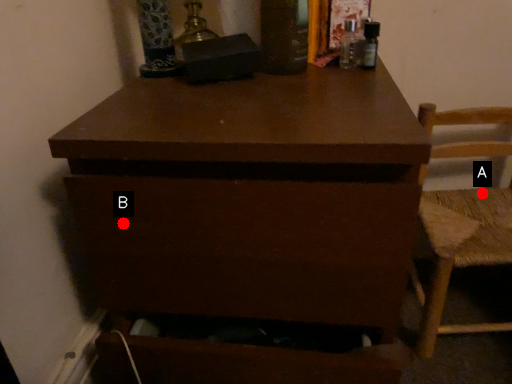
Question: Two points are circled on the image, labeled by A and B beside each circle. Among these points, which one is nearest to the camera?

Choices:
 (A) A is closer
 (B) B is closer

Answer: (B)